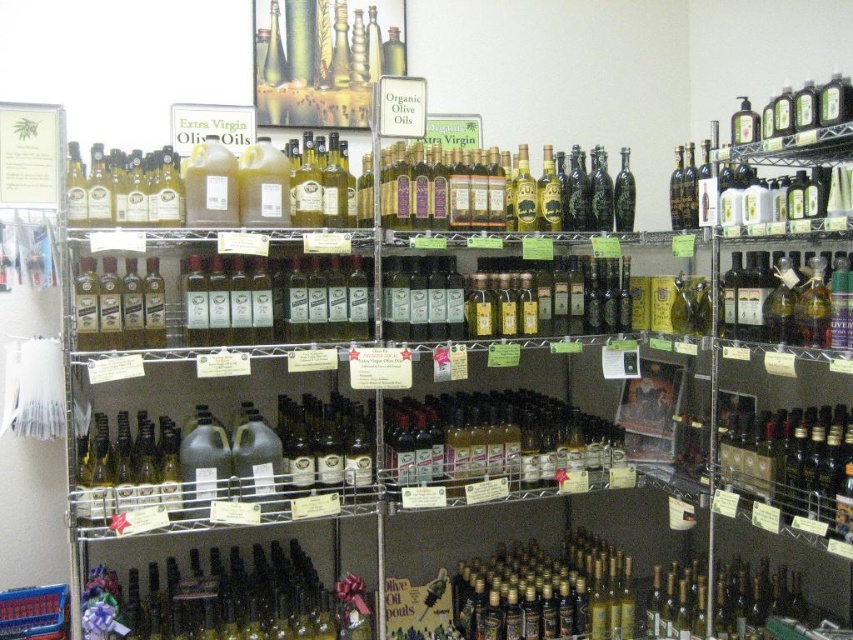
Which is in front, point (160, 612) or point (782, 477)?

Point (782, 477)

Does translucent glass bottles at lower center appear on the left side of matte glass bottle at center-right?

Correct, you'll find translucent glass bottles at lower center to the left of matte glass bottle at center-right.

Who is more forward, (155, 573) or (811, 440)?

Point (811, 440) is in front.

At what (x,y) coordinates should I click in order to perform the action: click on translucent glass bottles at lower center. Please return your answer as a coordinate pair (x, y). The image size is (853, 640). Looking at the image, I should click on (231, 598).

Measure the distance between translucent glass bottles at lower center and matte glass bottles at upper left.

A distance of 38.35 inches exists between translucent glass bottles at lower center and matte glass bottles at upper left.

Does translucent glass bottles at lower center have a greater height compared to matte glass bottles at upper left?

No.

Does point (218, 556) lie in front of point (100, 202)?

No, it is not.

The height and width of the screenshot is (640, 853). I want to click on translucent glass bottles at lower center, so click(x=231, y=598).

Is matte glass bottle at center-right to the left of matte glass bottles at upper left from the viewer's perspective?

No, matte glass bottle at center-right is not to the left of matte glass bottles at upper left.

Which of these two, matte glass bottle at center-right or matte glass bottles at upper left, stands taller?

matte glass bottle at center-right is taller.

The image size is (853, 640). What do you see at coordinates (788, 458) in the screenshot?
I see `matte glass bottle at center-right` at bounding box center [788, 458].

Where is `matte glass bottle at center-right`? The height and width of the screenshot is (640, 853). matte glass bottle at center-right is located at coordinates (788, 458).